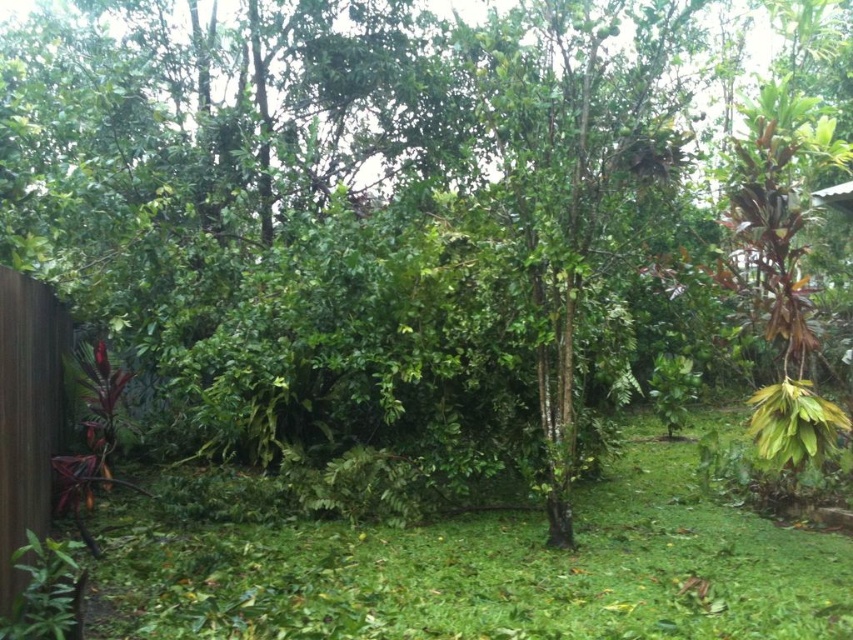
You are standing in the garden and want to place a small statue on the green grass at lower left. To ensure it is placed correctly, what are the coordinates where you should position the statue?

The coordinates for the green grass at lower left are at point (477, 570), so you should position the statue there.

You are standing in the garden and want to walk towards the brown wood fence at left. Which direction should you move relative to the green grass at lower left?

To reach the brown wood fence at left, you should move to the left of the green grass at lower left since the green grass at lower left is positioned to the right of the brown wood fence at left.